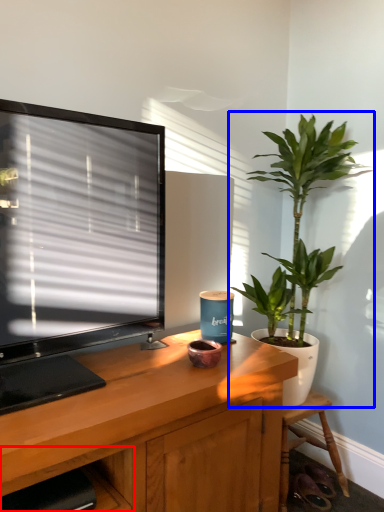
Question: Which point is further to the camera, shelf (highlighted by a red box) or houseplant (highlighted by a blue box)?

Choices:
 (A) shelf
 (B) houseplant

Answer: (B)